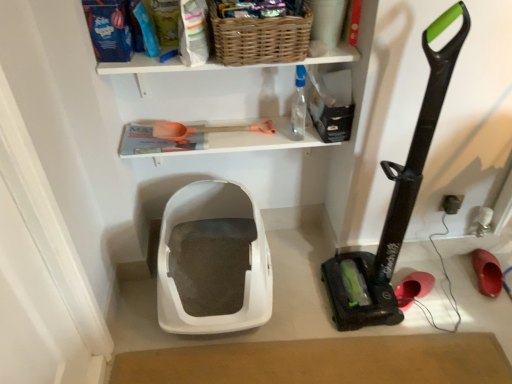
Question: Considering the relative sizes of rubberized red shoe at lower right, the first footwear from the left, and rubber matte shoe at lower right, the second footwear positioned from the left, in the image provided, is rubberized red shoe at lower right, the first footwear from the left, taller than rubber matte shoe at lower right, the second footwear positioned from the left,?

Choices:
 (A) yes
 (B) no

Answer: (A)

Question: Considering the relative positions of rubberized red shoe at lower right, the second footwear from the right, and rubber matte shoe at lower right, the second footwear positioned from the left, in the image provided, is rubberized red shoe at lower right, the second footwear from the right, behind rubber matte shoe at lower right, the second footwear positioned from the left,?

Choices:
 (A) no
 (B) yes

Answer: (A)

Question: From a real-world perspective, is rubberized red shoe at lower right, the second footwear from the right, positioned over rubber matte shoe at lower right, the second footwear positioned from the left, based on gravity?

Choices:
 (A) yes
 (B) no

Answer: (A)

Question: Does rubberized red shoe at lower right, the second footwear from the right, have a greater width compared to rubber matte shoe at lower right, the second footwear positioned from the left?

Choices:
 (A) yes
 (B) no

Answer: (B)

Question: Does rubberized red shoe at lower right, the second footwear from the right, appear on the right side of rubber matte shoe at lower right, which is the first footwear from right to left?

Choices:
 (A) no
 (B) yes

Answer: (A)

Question: Is orange plastic shovel at upper center wider or thinner than black plastic vacuum cleaner at right?

Choices:
 (A) wide
 (B) thin

Answer: (B)

Question: From a real-world perspective, is orange plastic shovel at upper center physically located above or below black plastic vacuum cleaner at right?

Choices:
 (A) above
 (B) below

Answer: (A)

Question: Which is correct: orange plastic shovel at upper center is inside black plastic vacuum cleaner at right, or outside of it?

Choices:
 (A) outside
 (B) inside

Answer: (A)

Question: Is point click(x=205, y=129) positioned closer to the camera than point click(x=337, y=296)?

Choices:
 (A) closer
 (B) farther

Answer: (A)

Question: Is rubber matte shoe at lower right, which is the first footwear from right to left, inside the boundaries of transparent plastic bottle at upper center, or outside?

Choices:
 (A) inside
 (B) outside

Answer: (B)

Question: In terms of width, does rubber matte shoe at lower right, the second footwear positioned from the left, look wider or thinner when compared to transparent plastic bottle at upper center?

Choices:
 (A) thin
 (B) wide

Answer: (B)

Question: In terms of size, does rubber matte shoe at lower right, which is the first footwear from right to left, appear bigger or smaller than transparent plastic bottle at upper center?

Choices:
 (A) small
 (B) big

Answer: (A)

Question: From a real-world perspective, is rubber matte shoe at lower right, which is the first footwear from right to left, above or below transparent plastic bottle at upper center?

Choices:
 (A) above
 (B) below

Answer: (B)

Question: In terms of height, does transparent plastic bottle at upper center look taller or shorter compared to black plastic electric outlet at lower right?

Choices:
 (A) short
 (B) tall

Answer: (B)

Question: Relative to black plastic electric outlet at lower right, is transparent plastic bottle at upper center in front or behind?

Choices:
 (A) behind
 (B) front

Answer: (B)